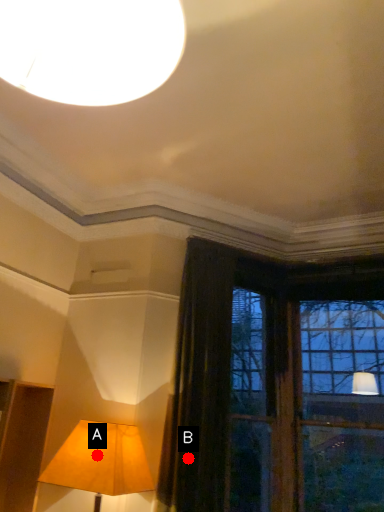
Question: Two points are circled on the image, labeled by A and B beside each circle. Which point is closer to the camera?

Choices:
 (A) A is closer
 (B) B is closer

Answer: (A)